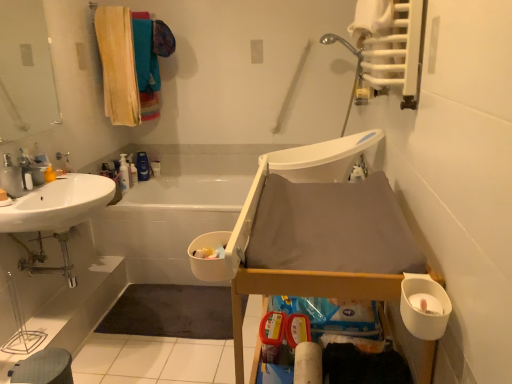
Question: Is soft yellow towel at upper left positioned with its back to gray fabric step stool at lower left?

Choices:
 (A) yes
 (B) no

Answer: (B)

Question: From the image's perspective, does soft yellow towel at upper left appear higher than gray fabric step stool at lower left?

Choices:
 (A) no
 (B) yes

Answer: (B)

Question: Is soft yellow towel at upper left thinner than gray fabric step stool at lower left?

Choices:
 (A) yes
 (B) no

Answer: (A)

Question: Is soft yellow towel at upper left beside gray fabric step stool at lower left?

Choices:
 (A) yes
 (B) no

Answer: (B)

Question: Does soft yellow towel at upper left lie behind gray fabric step stool at lower left?

Choices:
 (A) yes
 (B) no

Answer: (A)

Question: Choose the correct answer: Is white matte toilet paper at lower right, which is the 2th toilet paper in bottom-to-top order, inside white glossy bottle at upper left, which is counted as the 2th toiletry, starting from the back, or outside it?

Choices:
 (A) outside
 (B) inside

Answer: (A)

Question: Is white matte toilet paper at lower right, the second toilet paper positioned from the left, in front of or behind white glossy bottle at upper left, which is counted as the 2th toiletry, starting from the back, in the image?

Choices:
 (A) front
 (B) behind

Answer: (A)

Question: Is white matte toilet paper at lower right, acting as the first toilet paper starting from the front, to the left or to the right of white glossy bottle at upper left, the first toiletry viewed from the front, in the image?

Choices:
 (A) left
 (B) right

Answer: (B)

Question: From a real-world perspective, relative to white glossy bottle at upper left, which is counted as the 2th toiletry, starting from the back, is white matte toilet paper at lower right, the second toilet paper positioned from the left, vertically above or below?

Choices:
 (A) below
 (B) above

Answer: (B)

Question: From a real-world perspective, is brushed metal faucet at upper left physically located above or below transparent glass mirror at upper left?

Choices:
 (A) above
 (B) below

Answer: (B)

Question: From the image's perspective, is brushed metal faucet at upper left located above or below transparent glass mirror at upper left?

Choices:
 (A) above
 (B) below

Answer: (B)

Question: From their relative heights in the image, would you say brushed metal faucet at upper left is taller or shorter than transparent glass mirror at upper left?

Choices:
 (A) short
 (B) tall

Answer: (A)

Question: Looking at the image, does brushed metal faucet at upper left seem bigger or smaller compared to transparent glass mirror at upper left?

Choices:
 (A) small
 (B) big

Answer: (A)

Question: Is translucent plastic bottle at upper center, which is the first toiletry from back to front, bigger or smaller than white plastic bath at lower left?

Choices:
 (A) big
 (B) small

Answer: (B)

Question: Choose the correct answer: Is translucent plastic bottle at upper center, which is the first toiletry from back to front, inside white plastic bath at lower left or outside it?

Choices:
 (A) outside
 (B) inside

Answer: (A)